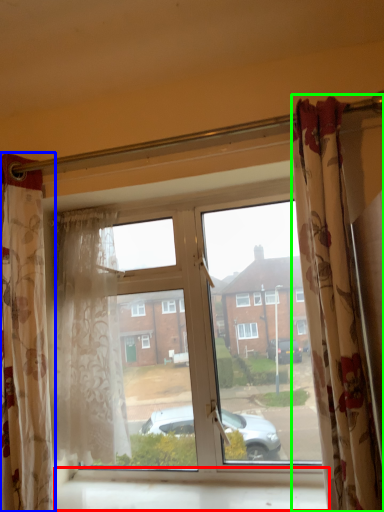
Question: Based on their relative distances, which object is nearer to window sill (highlighted by a red box)? Choose from curtain (highlighted by a blue box) and curtain (highlighted by a green box).

Choices:
 (A) curtain
 (B) curtain

Answer: (A)